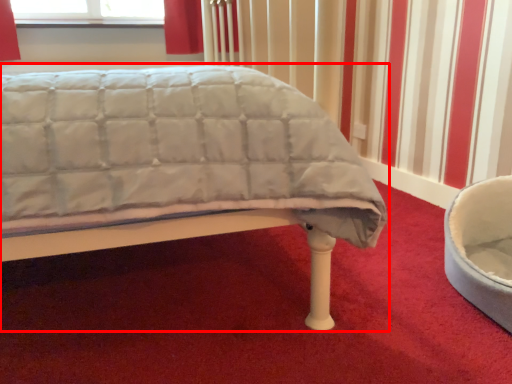
Question: Considering the relative positions of bed (annotated by the red box) and bean bag chair in the image provided, where is bed (annotated by the red box) located with respect to the staircase?

Choices:
 (A) right
 (B) left

Answer: (B)